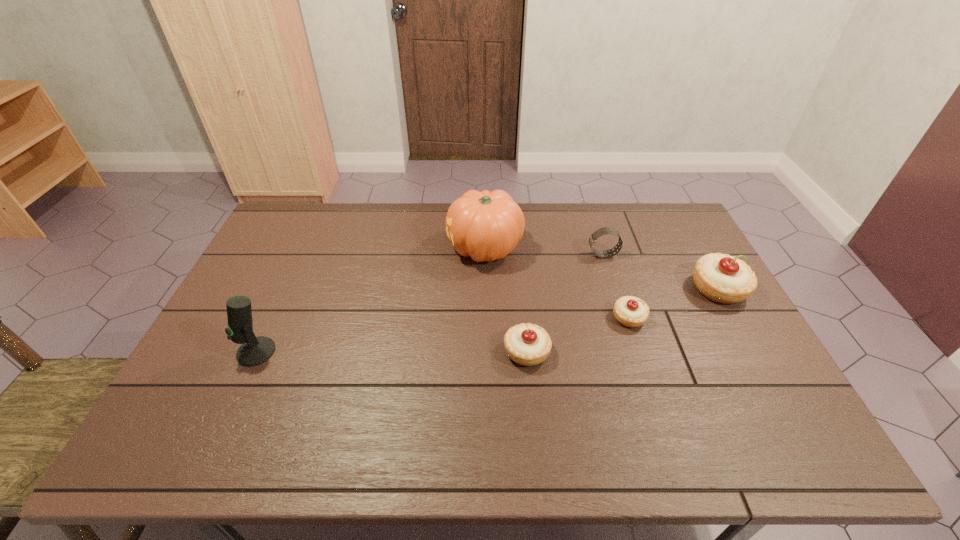
Where is `vacant space that satisfies the following two spatial constraints: 1. on the face of the fourth shortest object; 2. on the left side of the watch`? The height and width of the screenshot is (540, 960). vacant space that satisfies the following two spatial constraints: 1. on the face of the fourth shortest object; 2. on the left side of the watch is located at coordinates (613, 288).

Locate an element on the screen. Image resolution: width=960 pixels, height=540 pixels. free space that satisfies the following two spatial constraints: 1. on the carved face of the rightmost object; 2. on the right side of the pumpkin is located at coordinates (486, 288).

Locate an element on the screen. Image resolution: width=960 pixels, height=540 pixels. free region that satisfies the following two spatial constraints: 1. on the face of the watch; 2. on the right side of the second pastry from right to left is located at coordinates (623, 318).

Locate an element on the screen. The image size is (960, 540). vacant area that satisfies the following two spatial constraints: 1. on the face of the fourth shortest object; 2. on the left side of the watch is located at coordinates (613, 288).

I want to click on vacant position in the image that satisfies the following two spatial constraints: 1. on the face of the watch; 2. on the front side of the nearest pastry, so click(634, 352).

At what (x,y) coordinates should I click in order to perform the action: click on vacant space that satisfies the following two spatial constraints: 1. on the back side of the leftmost object; 2. on the right side of the second pastry from right to left. Please return your answer as a coordinate pair (x, y). The height and width of the screenshot is (540, 960). Looking at the image, I should click on (272, 318).

Find the location of a particular element. The width and height of the screenshot is (960, 540). free space that satisfies the following two spatial constraints: 1. on the carved face of the pumpkin; 2. on the left side of the shortest object is located at coordinates (486, 318).

The width and height of the screenshot is (960, 540). In order to click on free point that satisfies the following two spatial constraints: 1. on the face of the rightmost object; 2. on the left side of the watch in this screenshot , I will do `click(613, 288)`.